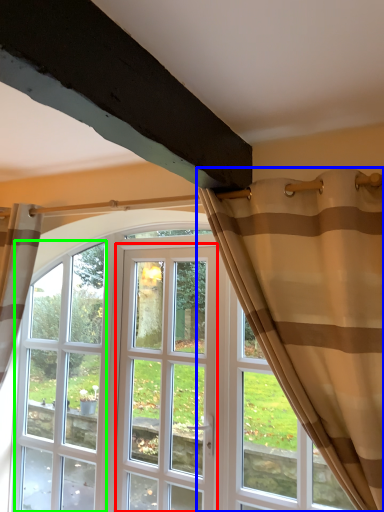
Question: Estimate the real-world distances between objects in this image. Which object is farther from screen door (highlighted by a red box), curtain (highlighted by a blue box) or window (highlighted by a green box)?

Choices:
 (A) curtain
 (B) window

Answer: (A)